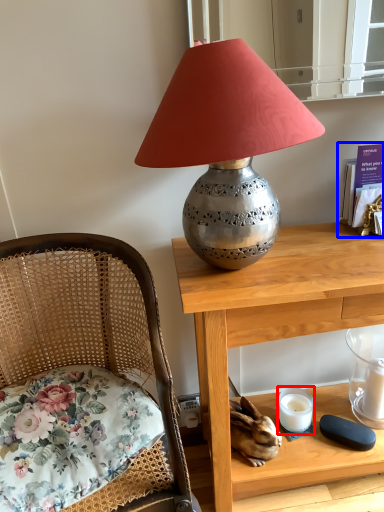
Question: Among these objects, which one is nearest to the camera, candle holder (highlighted by a red box) or book (highlighted by a blue box)?

Choices:
 (A) candle holder
 (B) book

Answer: (B)